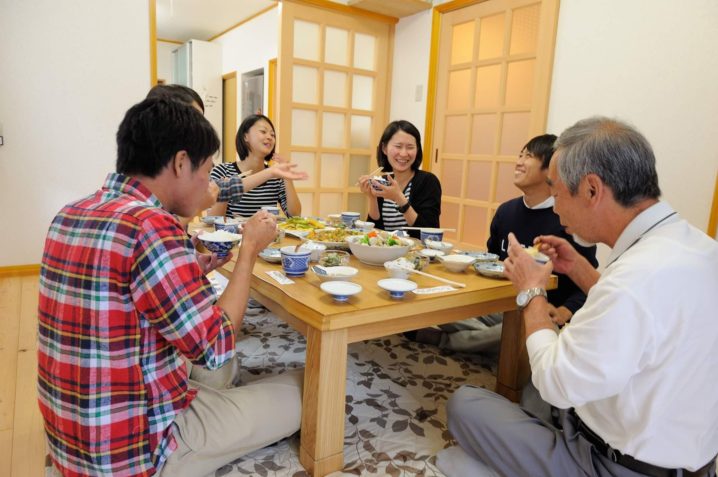
This screenshot has height=477, width=718. I want to click on wood floor, so point(11,403).